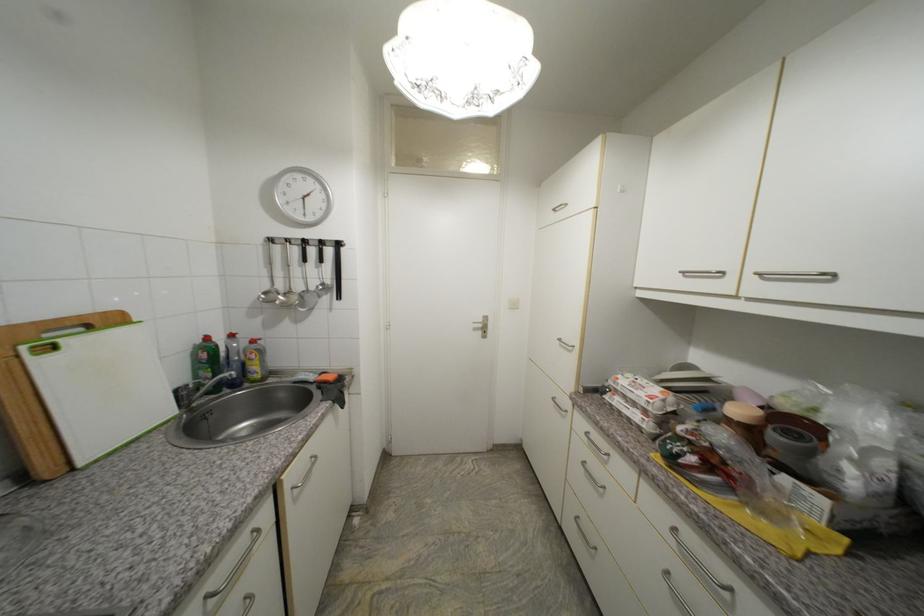
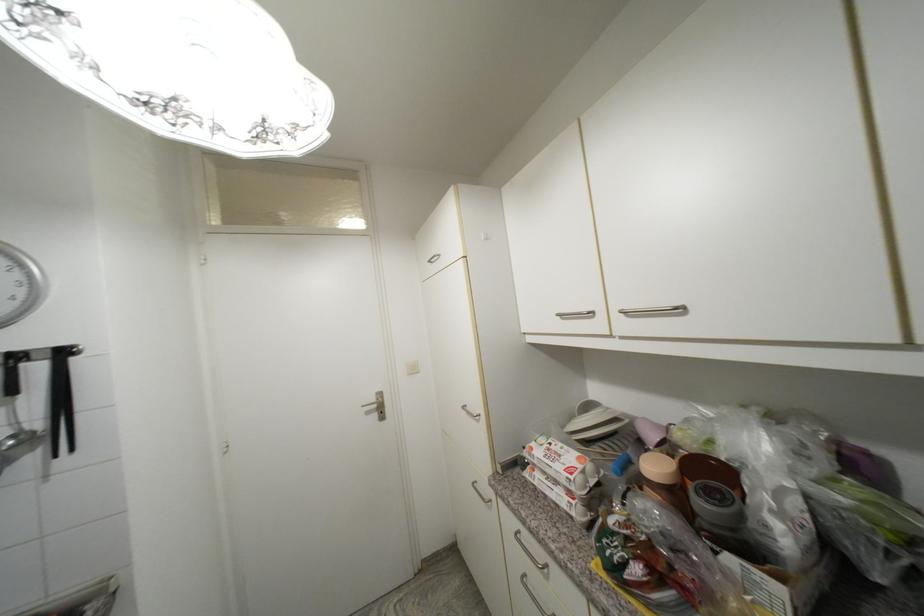
Question: I am providing you with two images of the same scene from different viewpoints. Please identify which objects are invisible in image2.

Choices:
 (A) white and black bowl
 (B) silver cabinet handle
 (C) plastic grocery bag
 (D) none of these

Answer: (D)